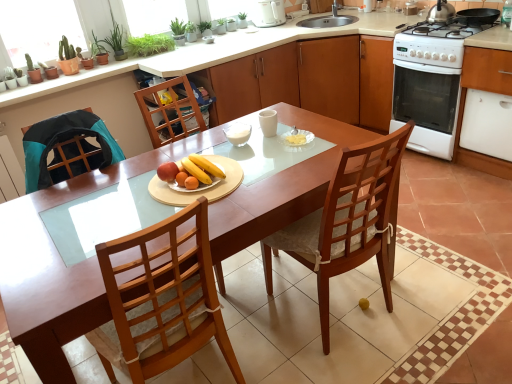
The height and width of the screenshot is (384, 512). I want to click on free point below stainless steel kettle at upper right (from a real-world perspective), so click(x=441, y=14).